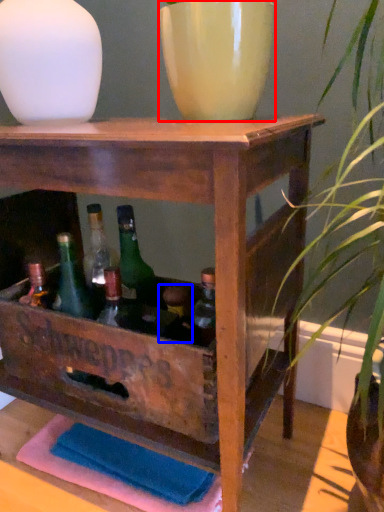
Question: Which object appears farthest to the camera in this image, flowerpot (highlighted by a red box) or bottle (highlighted by a blue box)?

Choices:
 (A) flowerpot
 (B) bottle

Answer: (B)